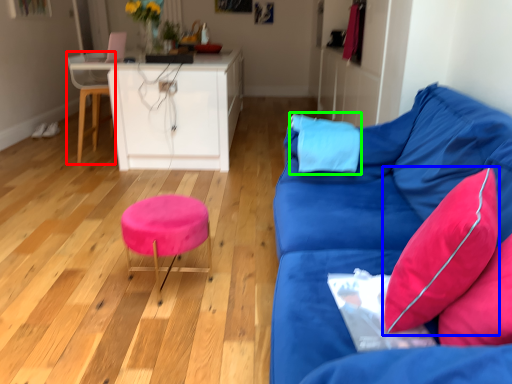
Question: Which object is the closest to the swivel chair (highlighted by a red box)? Choose among these: pillow (highlighted by a blue box) or pillow (highlighted by a green box).

Choices:
 (A) pillow
 (B) pillow

Answer: (B)